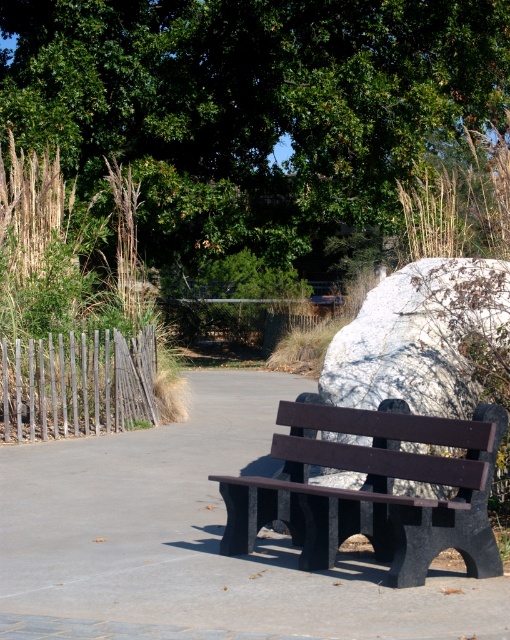
Question: Which object is positioned farthest from the dark gray concrete bench at center?

Choices:
 (A) white marble boulder at center right
 (B) green leafy tree at upper center
 (C) matte black bench at center

Answer: (B)

Question: Is green leafy tree at upper center further to camera compared to dark gray concrete bench at center?

Choices:
 (A) no
 (B) yes

Answer: (B)

Question: From the image, what is the correct spatial relationship of dark gray concrete bench at center in relation to white marble boulder at center right?

Choices:
 (A) below
 (B) above

Answer: (A)

Question: From the image, what is the correct spatial relationship of dark gray concrete bench at center in relation to white marble boulder at center right?

Choices:
 (A) right
 (B) left

Answer: (B)

Question: Which object appears farthest from the camera in this image?

Choices:
 (A) green leafy tree at upper center
 (B) white marble boulder at center right
 (C) dark gray concrete bench at center
 (D) matte black bench at center

Answer: (A)

Question: Which point is closer to the camera?

Choices:
 (A) green leafy tree at upper center
 (B) white marble boulder at center right
 (C) dark gray concrete bench at center
 (D) matte black bench at center

Answer: (C)